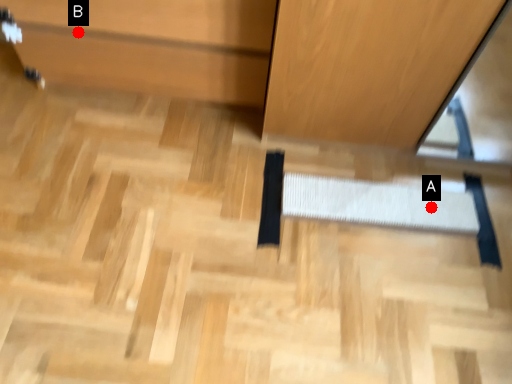
Question: Two points are circled on the image, labeled by A and B beside each circle. Among these points, which one is nearest to the camera?

Choices:
 (A) A is closer
 (B) B is closer

Answer: (B)